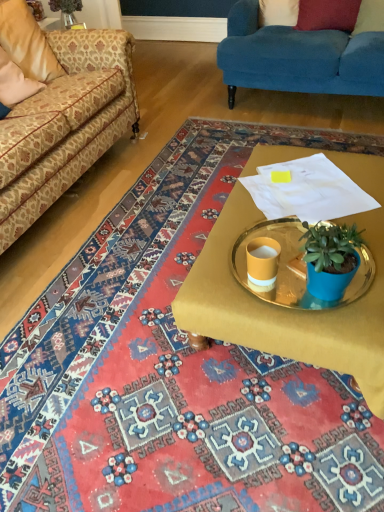
Identify the location of free spot behind gold metallic tray at center. This screenshot has height=512, width=384. (218, 167).